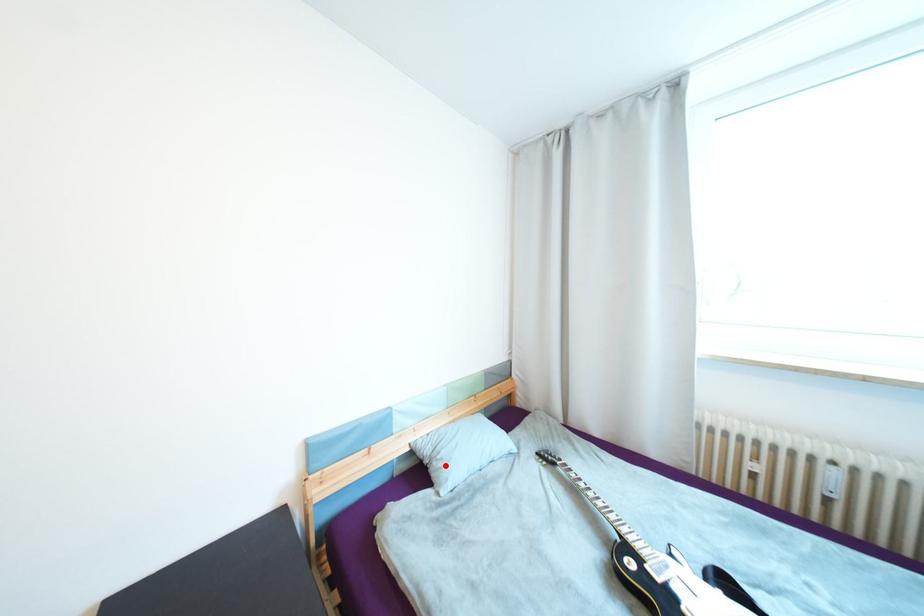
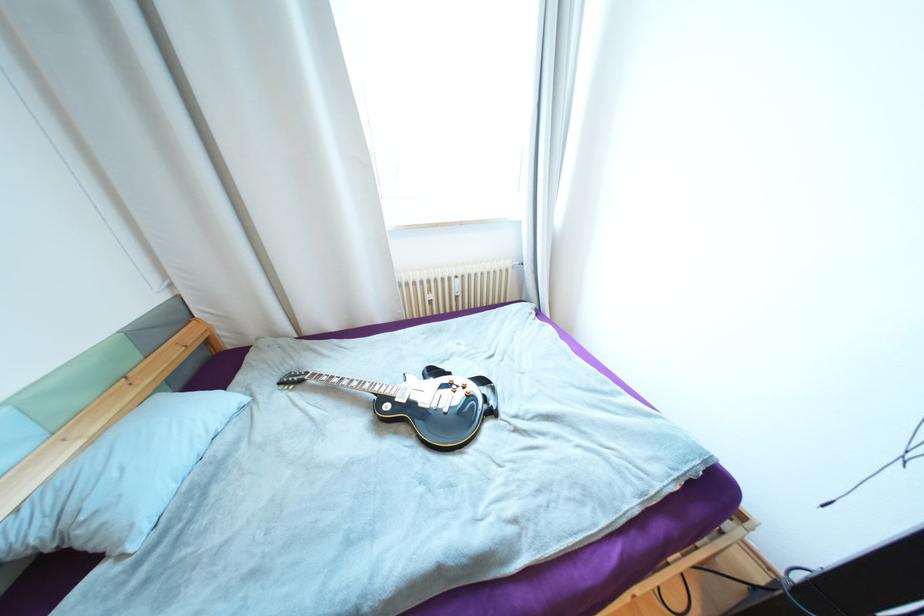
Question: I am providing you with two images of the same scene from different viewpoints. Image1 has a red point marked. In image2, the corresponding 3D location appears at what relative position? Reply with the corresponding letter.

Choices:
 (A) Closer
 (B) Farther

Answer: (A)